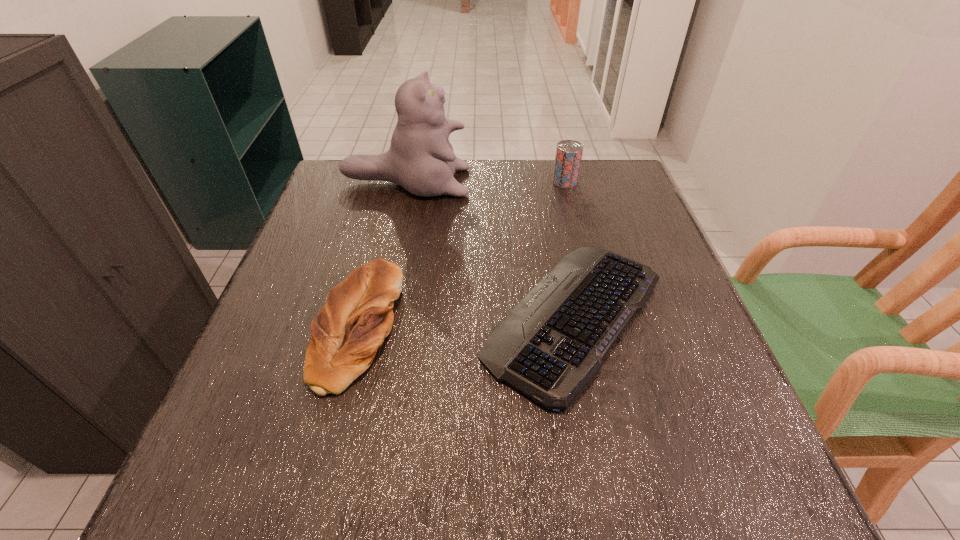
Locate an element on the screen. Image resolution: width=960 pixels, height=540 pixels. vacant space at the far left corner is located at coordinates (368, 187).

In the image, there is a desktop. In order to click on vacant space at the far right corner in this screenshot , I will do tap(611, 165).

This screenshot has height=540, width=960. I want to click on free space at the near right corner of the desktop, so click(x=784, y=502).

Identify the location of free space between the tallest object and the beer can. The height and width of the screenshot is (540, 960). (486, 182).

Find the location of `free space between the computer keyboard and the tallest object`. free space between the computer keyboard and the tallest object is located at coordinates (491, 249).

Find the location of `free space between the second shortest object and the shortest object`. free space between the second shortest object and the shortest object is located at coordinates point(466,322).

You are a GUI agent. You are given a task and a screenshot of the screen. Output one action in this format:
    pyautogui.click(x=<x>, y=<y>)
    Task: Click on the unoccupied area between the tallest object and the beer can
    
    Given the screenshot: What is the action you would take?
    pyautogui.click(x=486, y=182)

The height and width of the screenshot is (540, 960). What are the coordinates of `unoccupied area between the shortest object and the bread` in the screenshot? It's located at (466, 322).

Find the location of `free spot between the beer can and the cat`. free spot between the beer can and the cat is located at coordinates (486, 182).

The height and width of the screenshot is (540, 960). Identify the location of empty space that is in between the third shortest object and the computer keyboard. (569, 249).